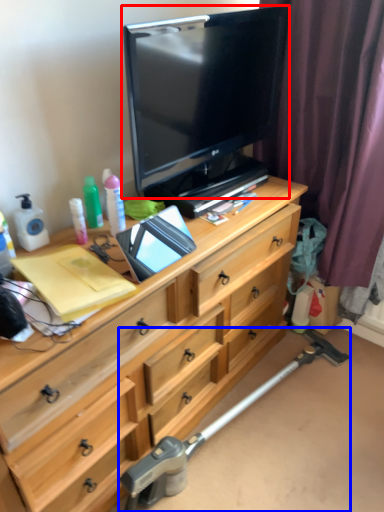
Question: Which object is closer to the camera taking this photo, television (highlighted by a red box) or crutch (highlighted by a blue box)?

Choices:
 (A) television
 (B) crutch

Answer: (A)